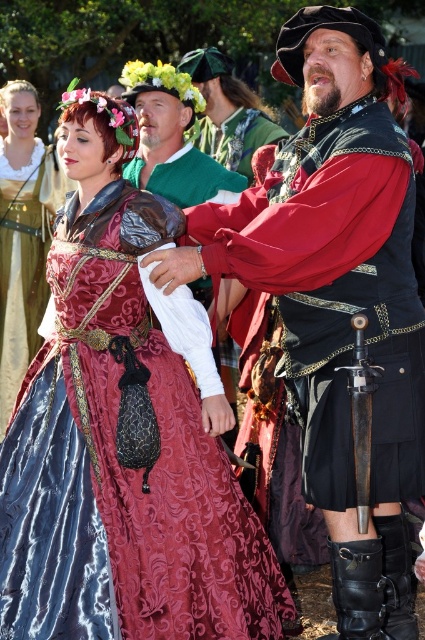
You are a stagehand at the Renaissance fair and need to place a 5.5 feet wide decorative banner between the matte black kilt at center and the velvet red kilt at center. Can the banner fit without overlapping either kilt?

The distance between the matte black kilt at center and the velvet red kilt at center is 6.00 feet. Since the banner is 5.5 feet wide, it can fit within the space as 5.5 is less than 6.00, leaving 0.5 feet of space on each side.

You are a photographer at the Renaissance fair and need to capture both the velvet burgundy gown at center and the matte black kilt at center in a single shot. Since you want the taller object to be fully visible, which one should you frame first?

The velvet burgundy gown at center is taller than the matte black kilt at center, so you should frame the velvet burgundy gown at center first to ensure it is fully visible in the photo.

Based on the photo, you are a costume designer who needs to determine which costume requires more fabric. Based on the image, which of the two costumes at the center, the velvet burgundy gown at center or the velvet maroon dress at center, would need more fabric?

The velvet burgundy gown at center has a larger size compared to the velvet maroon dress at center, so it would require more fabric.